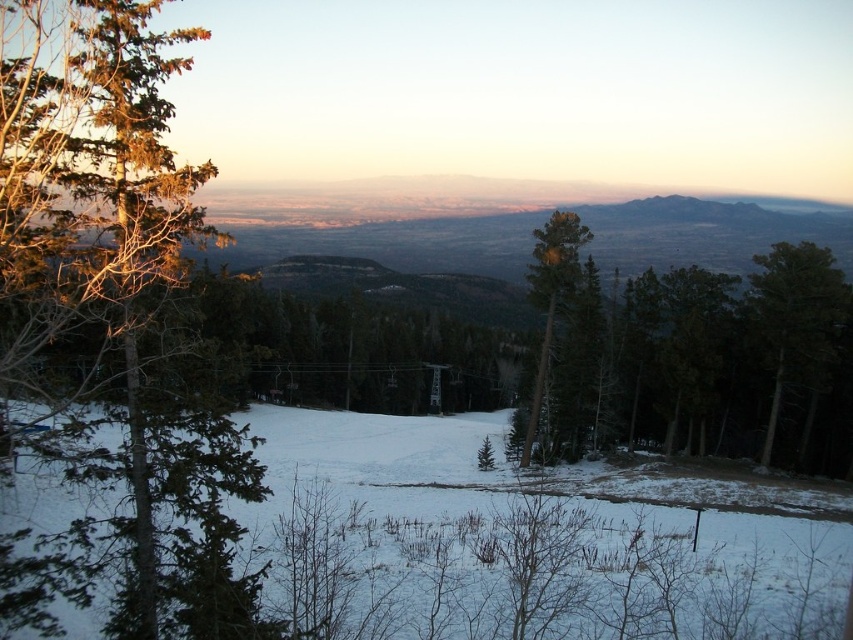
Question: Which object is farther from the camera taking this photo?

Choices:
 (A) white snow ski slope at center
 (B) green matte tree at left
 (C) green matte tree at right

Answer: (C)

Question: Does white snow ski slope at center appear on the left side of green matte tree at center?

Choices:
 (A) yes
 (B) no

Answer: (A)

Question: Considering the relative positions of green matte tree at left and green matte tree at center in the image provided, where is green matte tree at left located with respect to green matte tree at center?

Choices:
 (A) above
 (B) below

Answer: (B)

Question: Among these points, which one is nearest to the camera?

Choices:
 (A) (790, 332)
 (B) (549, 250)
 (C) (328, 528)
 (D) (187, 548)

Answer: (D)

Question: Which point is farther to the camera?

Choices:
 (A) green matte tree at left
 (B) green matte tree at right
 (C) green matte tree at center

Answer: (B)

Question: Is green matte tree at left bigger than green matte tree at right?

Choices:
 (A) no
 (B) yes

Answer: (B)